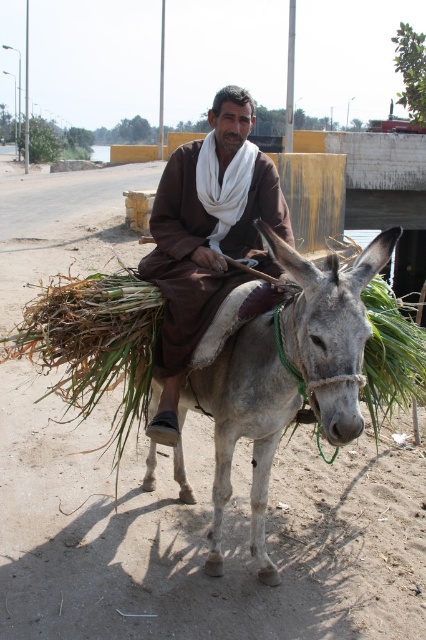
You are a hiker who wants to take a photo of the green leafy plant at upper right and the green leafy plant at center. Which one should you stand closer to to get a clear shot?

The green leafy plant at upper right is much taller than the green leafy plant at center, so you should stand closer to the green leafy plant at center to capture it in the photo.